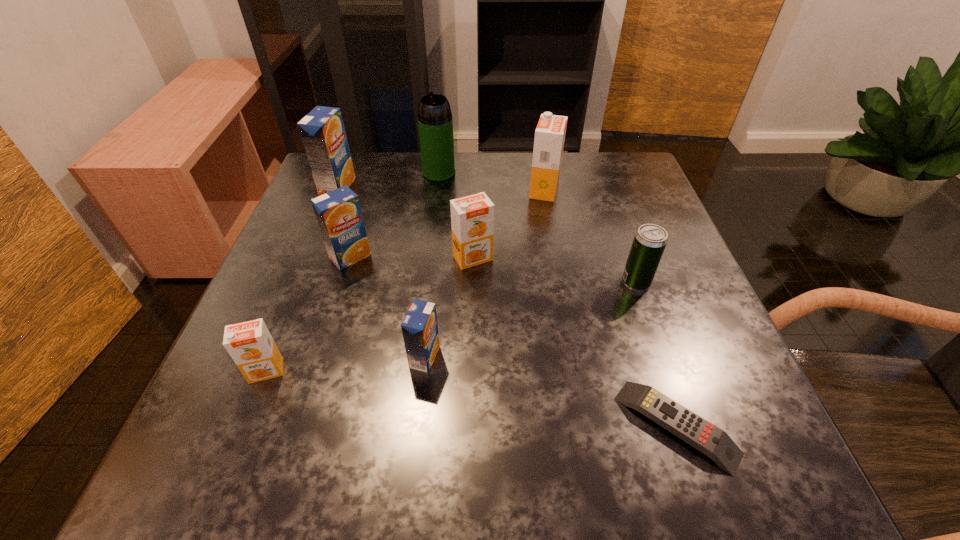
You are a GUI agent. You are given a task and a screenshot of the screen. Output one action in this format:
    pyautogui.click(x=<x>, y=<y>)
    Task: Click on the object located at the far left corner
    The width and height of the screenshot is (960, 540).
    Given the screenshot: What is the action you would take?
    pyautogui.click(x=322, y=131)

Where is `object that is at the near right corner`? object that is at the near right corner is located at coordinates (715, 443).

Find the location of a particular element. The height and width of the screenshot is (540, 960). free space at the far edge of the desktop is located at coordinates (412, 183).

Locate an element on the screen. The width and height of the screenshot is (960, 540). vacant region at the left edge of the desktop is located at coordinates (230, 395).

What are the coordinates of `free space at the right edge` in the screenshot? It's located at (742, 376).

Find the location of a particular element. vacant area at the far left corner is located at coordinates tap(380, 163).

Image resolution: width=960 pixels, height=540 pixels. In order to click on free space at the near left corner of the desktop in this screenshot , I will do `click(295, 473)`.

Where is `free spot at the far right corner of the desktop`? Image resolution: width=960 pixels, height=540 pixels. free spot at the far right corner of the desktop is located at coordinates (585, 172).

Image resolution: width=960 pixels, height=540 pixels. What are the coordinates of `vacant space at the near right corner of the desktop` in the screenshot? It's located at (754, 460).

At what (x,y) coordinates should I click in order to perform the action: click on free spot between the biggest orange orange juice and the biggest blue orange_juice. Please return your answer as a coordinate pair (x, y). Image resolution: width=960 pixels, height=540 pixels. Looking at the image, I should click on (441, 188).